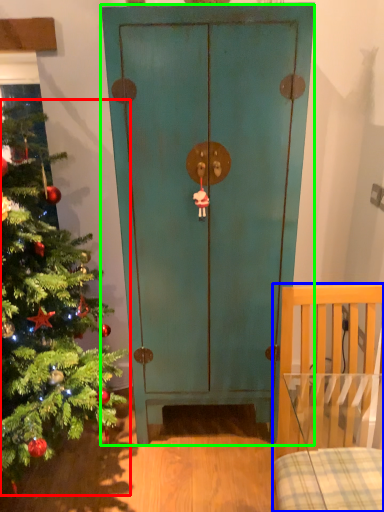
Question: Estimate the real-world distances between objects in this image. Which object is farther from christmas tree (highlighted by a red box), furniture (highlighted by a blue box) or door (highlighted by a green box)?

Choices:
 (A) furniture
 (B) door

Answer: (A)